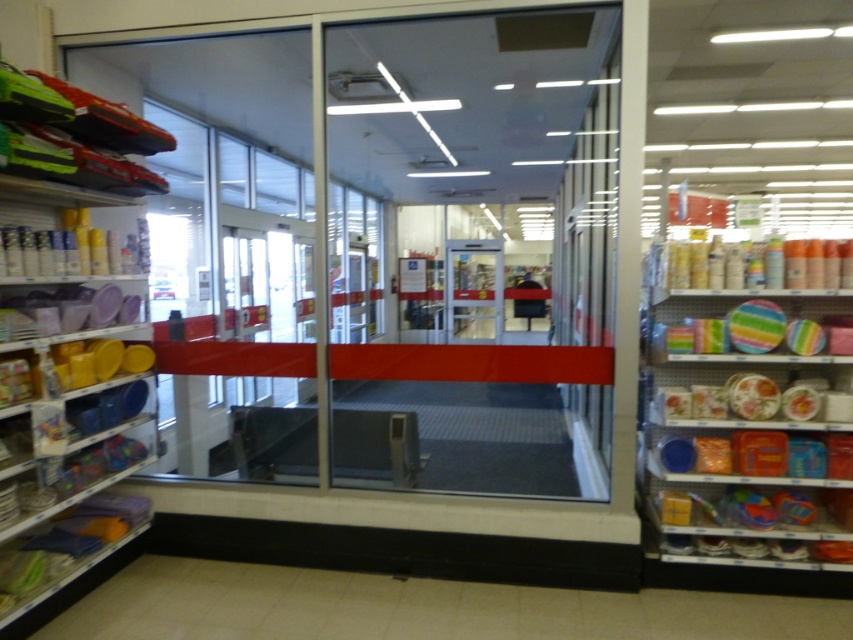
Question: Based on their relative distances, which object is farther from the matte plastic plates at right?

Choices:
 (A) white tile floor at lower center
 (B) clear glass door at center
 (C) matte plastic containers at right
 (D) matte plastic containers at left

Answer: (B)

Question: Where is matte plastic containers at right located in relation to clear glass door at center in the image?

Choices:
 (A) left
 (B) right

Answer: (B)

Question: In this image, where is white tile floor at lower center located relative to matte plastic containers at right?

Choices:
 (A) left
 (B) right

Answer: (A)

Question: Is white tile floor at lower center in front of matte plastic containers at right?

Choices:
 (A) no
 (B) yes

Answer: (B)

Question: Which object appears farthest from the camera in this image?

Choices:
 (A) matte plastic containers at left
 (B) white tile floor at lower center
 (C) matte plastic containers at right

Answer: (C)

Question: Estimate the real-world distances between objects in this image. Which object is farther from the clear glass door at center?

Choices:
 (A) matte plastic plates at right
 (B) matte plastic containers at right
 (C) matte plastic containers at left

Answer: (B)